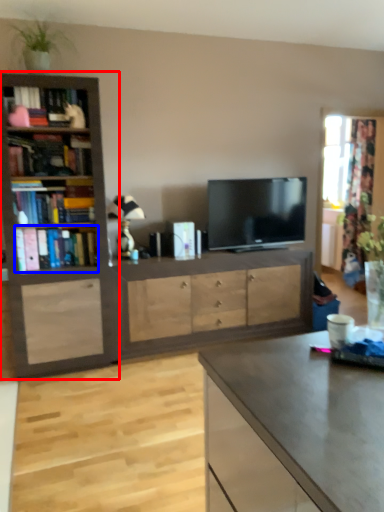
Question: Which point is closer to the camera, bookcase (highlighted by a red box) or book (highlighted by a blue box)?

Choices:
 (A) bookcase
 (B) book

Answer: (A)